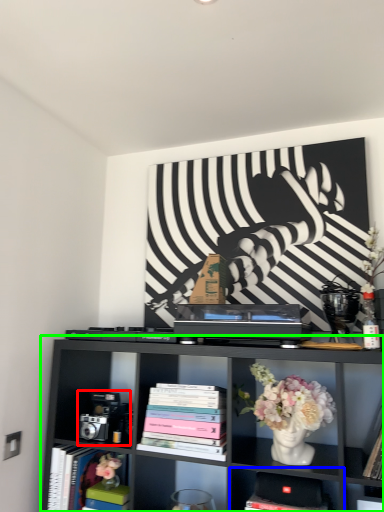
Question: Which is nearer to the toy (highlighted by a red box)? shelf (highlighted by a blue box) or shelf (highlighted by a green box).

Choices:
 (A) shelf
 (B) shelf

Answer: (B)